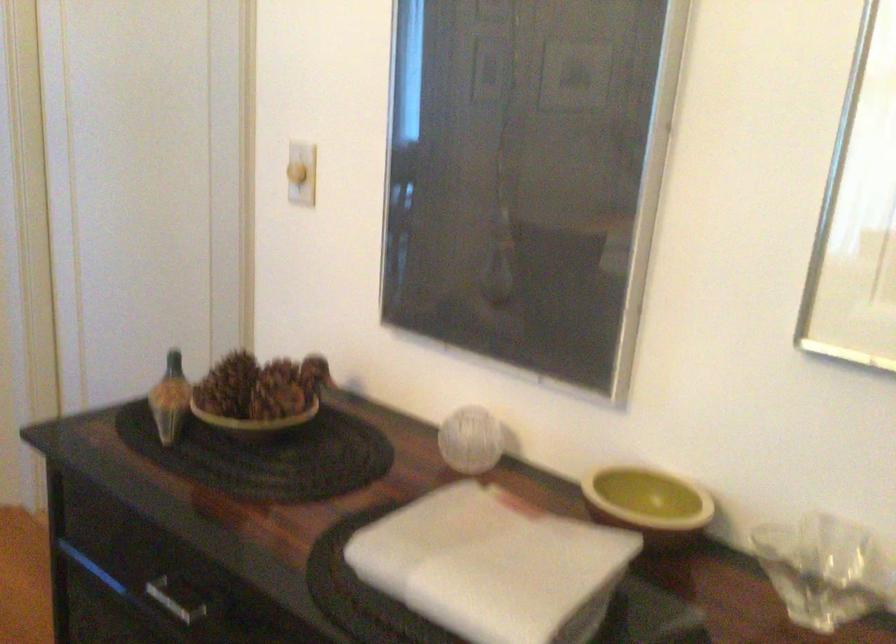
At what (x,y) coordinates should I click in order to perform the action: click on light dimmer knob. Please return your answer as a coordinate pair (x, y). Looking at the image, I should click on (297, 173).